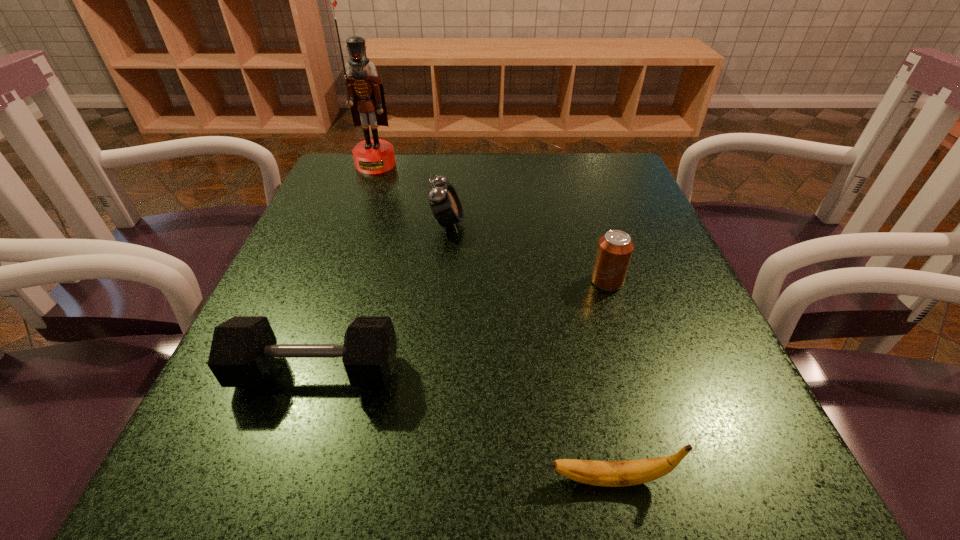
Find the location of a particular element. Image resolution: width=960 pixels, height=540 pixels. vacant area located on the front of the third nearest object is located at coordinates (661, 456).

This screenshot has width=960, height=540. I want to click on vacant space located on the right of the fourth farthest object, so click(667, 372).

You are a GUI agent. You are given a task and a screenshot of the screen. Output one action in this format:
    pyautogui.click(x=<x>, y=<y>)
    Task: Click on the blank area located on the peel of the banana from the top
    This screenshot has height=540, width=960.
    Given the screenshot: What is the action you would take?
    pyautogui.click(x=396, y=479)

At what (x,y) coordinates should I click in order to perform the action: click on free space located 0.100m on the peel of the banana from the top. Please return your answer as a coordinate pair (x, y). The image size is (960, 540). Looking at the image, I should click on (464, 479).

Locate an element on the screen. The width and height of the screenshot is (960, 540). vacant space located 0.400m on the peel of the banana from the top is located at coordinates point(210,479).

Find the location of a particular element. This screenshot has width=960, height=540. object present at the far edge is located at coordinates (365, 95).

Locate an element on the screen. object that is at the near edge is located at coordinates (633, 472).

Locate an element on the screen. nutcracker that is at the left edge is located at coordinates (365, 95).

At what (x,y) coordinates should I click in order to perform the action: click on dumbbell at the left edge. Please return your answer as a coordinate pair (x, y). Looking at the image, I should click on (243, 349).

At what (x,y) coordinates should I click in order to perform the action: click on can that is at the right edge. Please return your answer as a coordinate pair (x, y). This screenshot has height=540, width=960. Looking at the image, I should click on (615, 248).